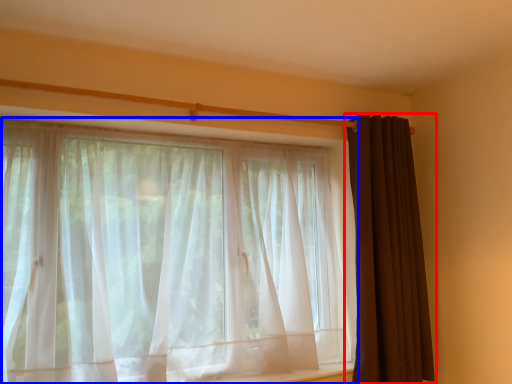
Question: Which object appears farthest to the camera in this image, curtain (highlighted by a red box) or curtain (highlighted by a blue box)?

Choices:
 (A) curtain
 (B) curtain

Answer: (A)